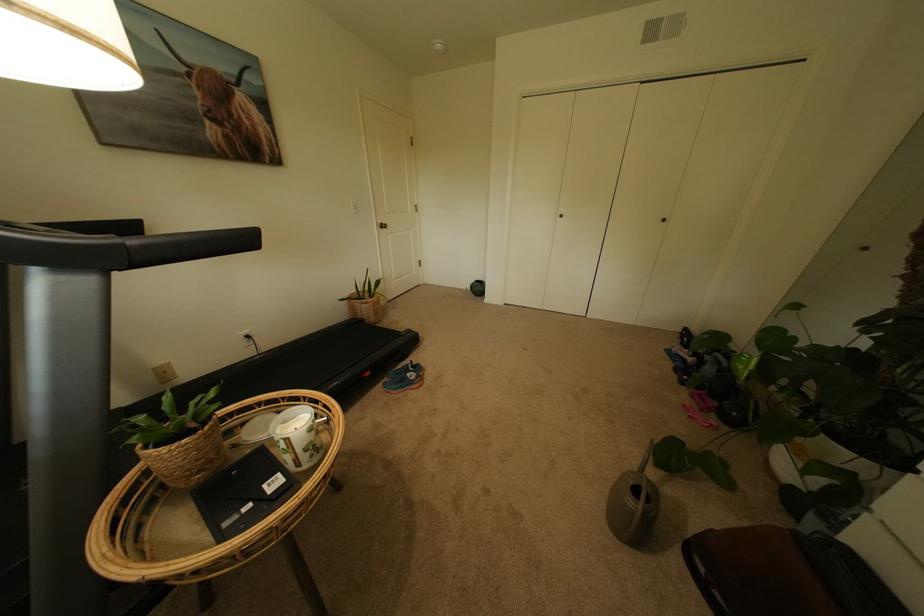
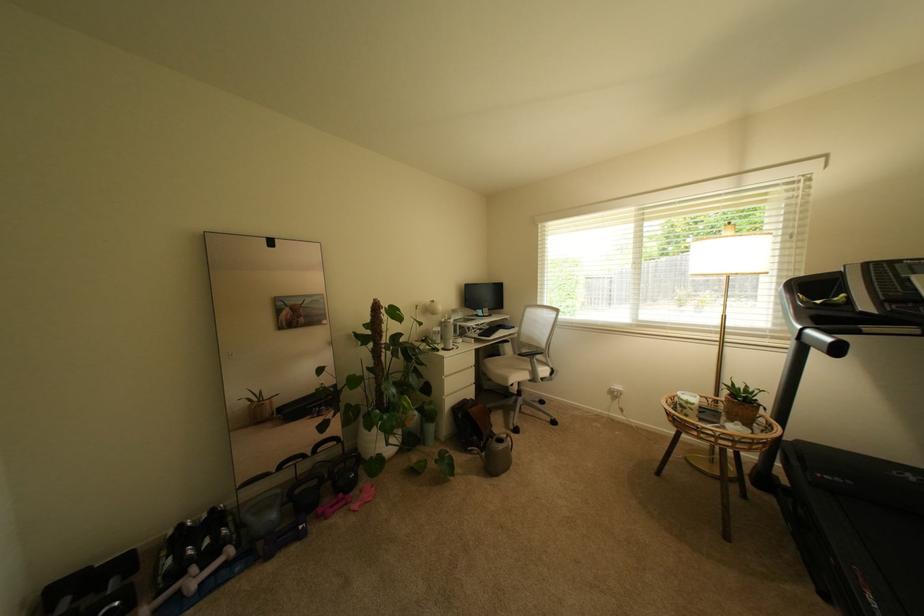
The point at (x=131, y=246) is marked in the first image. Where is the corresponding point in the second image?

(807, 331)